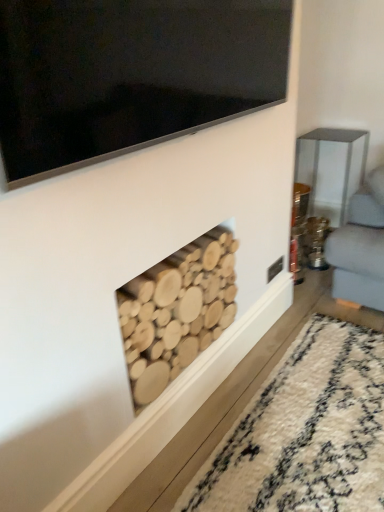
Describe the element at coordinates (130, 75) in the screenshot. I see `black glossy tv at upper center` at that location.

Where is `black glossy tv at upper center`? black glossy tv at upper center is located at coordinates (130, 75).

I want to click on natural wood logs at center, so click(x=177, y=311).

This screenshot has height=512, width=384. What do you see at coordinates (177, 311) in the screenshot?
I see `natural wood logs at center` at bounding box center [177, 311].

At what (x,y) coordinates should I click in order to perform the action: click on black glossy tv at upper center. Please return your answer as a coordinate pair (x, y). The image size is (384, 512). Looking at the image, I should click on (130, 75).

Visually, is black glossy tv at upper center positioned to the left or to the right of natural wood logs at center?

Clearly, black glossy tv at upper center is on the right of natural wood logs at center in the image.

Which object is more forward, black glossy tv at upper center or natural wood logs at center?

black glossy tv at upper center.

Which point is more distant from viewer, [9,32] or [175,298]?

Point [175,298]

From the image's perspective, is black glossy tv at upper center on top of natural wood logs at center?

Yes, from the image's perspective, black glossy tv at upper center is on top of natural wood logs at center.

From a real-world perspective, is black glossy tv at upper center above or below natural wood logs at center?

black glossy tv at upper center is above natural wood logs at center.

In terms of width, does black glossy tv at upper center look wider or thinner when compared to natural wood logs at center?

Considering their sizes, black glossy tv at upper center looks slimmer than natural wood logs at center.

Based on the photo, from their relative heights in the image, would you say black glossy tv at upper center is taller or shorter than natural wood logs at center?

Clearly, black glossy tv at upper center is shorter compared to natural wood logs at center.

Considering the relative sizes of black glossy tv at upper center and natural wood logs at center in the image provided, is black glossy tv at upper center bigger than natural wood logs at center?

No, black glossy tv at upper center is not bigger than natural wood logs at center.

Is black glossy tv at upper center positioned beyond the bounds of natural wood logs at center?

black glossy tv at upper center is positioned outside natural wood logs at center.

Is black glossy tv at upper center far away from natural wood logs at center?

They are positioned close to each other.

Is black glossy tv at upper center facing towards natural wood logs at center?

No, black glossy tv at upper center is not turned towards natural wood logs at center.

Can you tell me how much black glossy tv at upper center and natural wood logs at center differ in facing direction?

They differ by 0.343 degrees in their facing directions.

At what (x,y) coordinates should I click in order to perform the action: click on television that is in front of the natural wood logs at center. Please return your answer as a coordinate pair (x, y). Image resolution: width=384 pixels, height=512 pixels. Looking at the image, I should click on (130, 75).

Which is more to the left, natural wood logs at center or black glossy tv at upper center?

natural wood logs at center is more to the left.

Between natural wood logs at center and black glossy tv at upper center, which one is positioned behind?

natural wood logs at center is behind.

Considering the positions of points (224, 325) and (287, 74), is point (224, 325) closer to camera compared to point (287, 74)?

No, it is not.

From the image's perspective, does natural wood logs at center appear higher than black glossy tv at upper center?

No.

From a real-world perspective, who is located lower, natural wood logs at center or black glossy tv at upper center?

natural wood logs at center is physically lower.

Which of these two, natural wood logs at center or black glossy tv at upper center, is wider?

Wider between the two is natural wood logs at center.

Is natural wood logs at center shorter than black glossy tv at upper center?

In fact, natural wood logs at center may be taller than black glossy tv at upper center.

Who is bigger, natural wood logs at center or black glossy tv at upper center?

With larger size is natural wood logs at center.

Would you say black glossy tv at upper center is part of natural wood logs at center's contents?

Actually, black glossy tv at upper center is outside natural wood logs at center.

Is natural wood logs at center in contact with black glossy tv at upper center?

No.

Is black glossy tv at upper center at the back of natural wood logs at center?

No, natural wood logs at center is not facing the opposite direction of black glossy tv at upper center.

How many degrees apart are the facing directions of natural wood logs at center and black glossy tv at upper center?

0.343 degrees.

How distant is natural wood logs at center from black glossy tv at upper center?

natural wood logs at center and black glossy tv at upper center are 23.72 inches apart.

The width and height of the screenshot is (384, 512). I want to click on fireplace below the black glossy tv at upper center (from a real-world perspective), so click(x=177, y=311).

I want to click on fireplace below the black glossy tv at upper center (from the image's perspective), so click(x=177, y=311).

The width and height of the screenshot is (384, 512). Find the location of `television that is above the natural wood logs at center (from the image's perspective)`. television that is above the natural wood logs at center (from the image's perspective) is located at coordinates (130, 75).